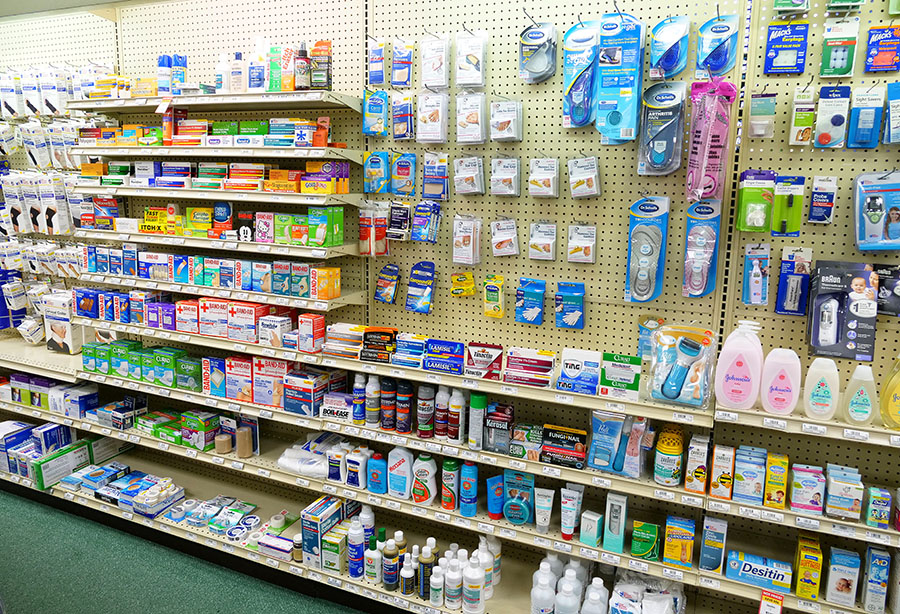
Identify the location of large clear johnson bottle dispenser. (743, 365), (734, 328).